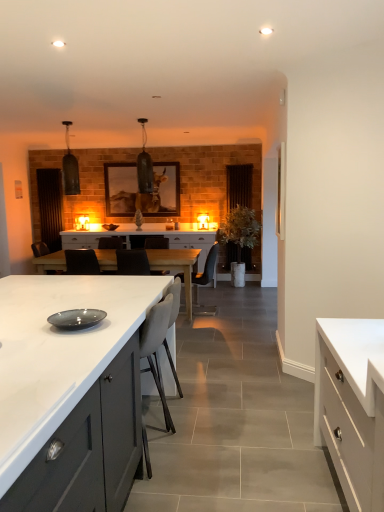
This screenshot has height=512, width=384. What are the coordinates of `vacant area situated below matte gray plate at center (from a real-world perspective)` in the screenshot? It's located at (97, 324).